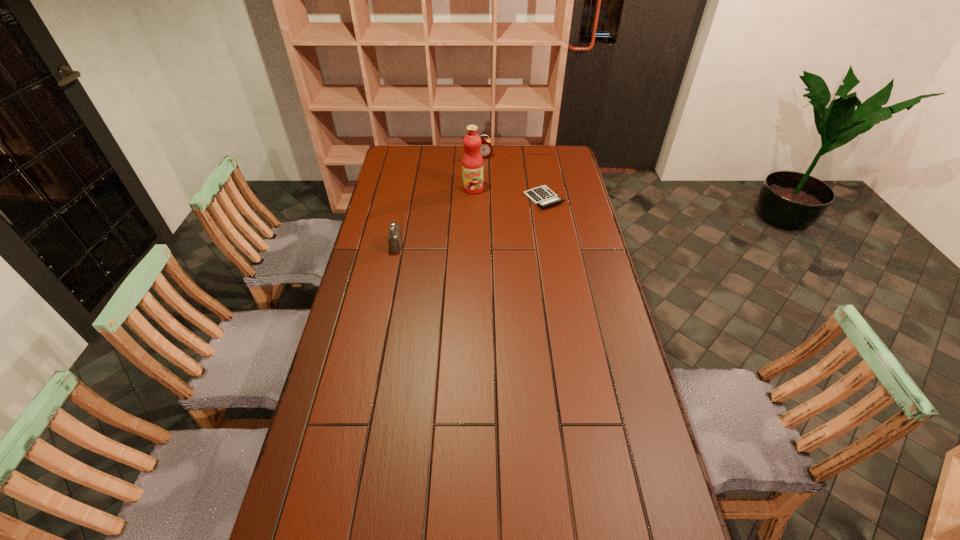
Where is `free point between the leftmost object and the shortest object`? This screenshot has height=540, width=960. free point between the leftmost object and the shortest object is located at coordinates (470, 222).

Where is `free space between the farthest object and the nearest object`? The image size is (960, 540). free space between the farthest object and the nearest object is located at coordinates (440, 201).

At what (x,y) coordinates should I click in order to perform the action: click on free space between the leftmost object and the farthest object. Please return your answer as a coordinate pair (x, y). The height and width of the screenshot is (540, 960). Looking at the image, I should click on (440, 201).

Locate an element on the screen. Image resolution: width=960 pixels, height=540 pixels. free point between the alarm clock and the rightmost object is located at coordinates (514, 177).

What are the coordinates of `vacant space that is in between the calculator and the leftmost object` in the screenshot? It's located at (470, 222).

Point out which object is positioned as the second nearest to the calculator. Please provide its 2D coordinates. Your answer should be formatted as a tuple, i.e. [(x, y)], where the tuple contains the x and y coordinates of a point satisfying the conditions above.

[(486, 149)]

Locate which object ranks third in proximity to the shortest object. Please provide its 2D coordinates. Your answer should be formatted as a tuple, i.e. [(x, y)], where the tuple contains the x and y coordinates of a point satisfying the conditions above.

[(395, 239)]

Where is `vacant region that satisfies the following two spatial constraints: 1. on the front side of the fruit juice; 2. on the left side of the shortest object`? The width and height of the screenshot is (960, 540). vacant region that satisfies the following two spatial constraints: 1. on the front side of the fruit juice; 2. on the left side of the shortest object is located at coordinates (473, 198).